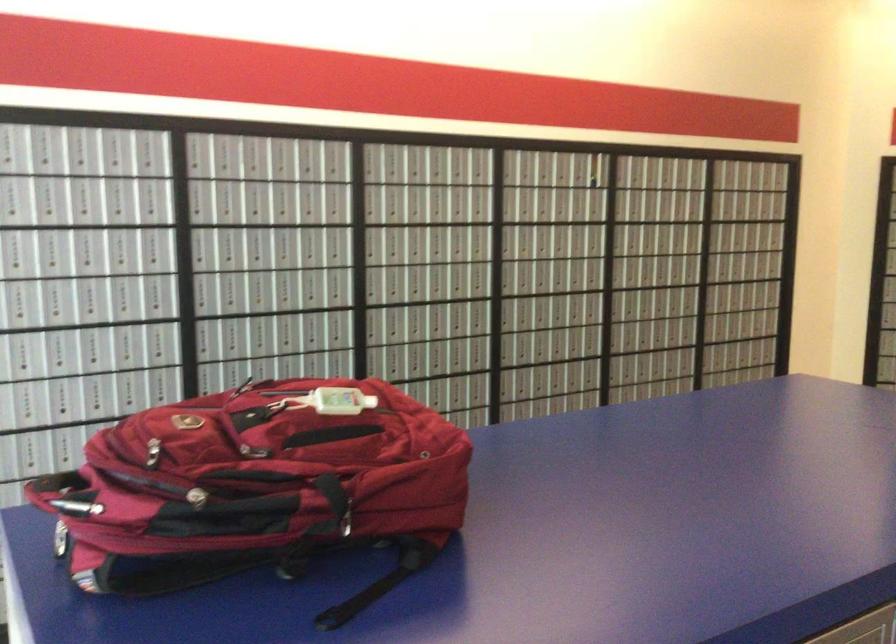
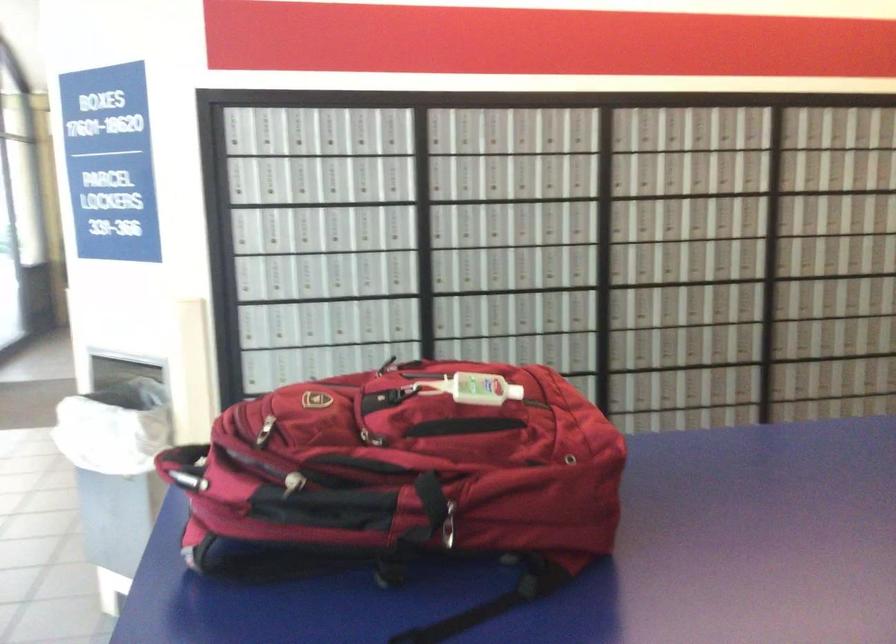
Looking at this image, which direction would the cameraman need to move to produce the second image?

The cameraman walked toward right, forward.